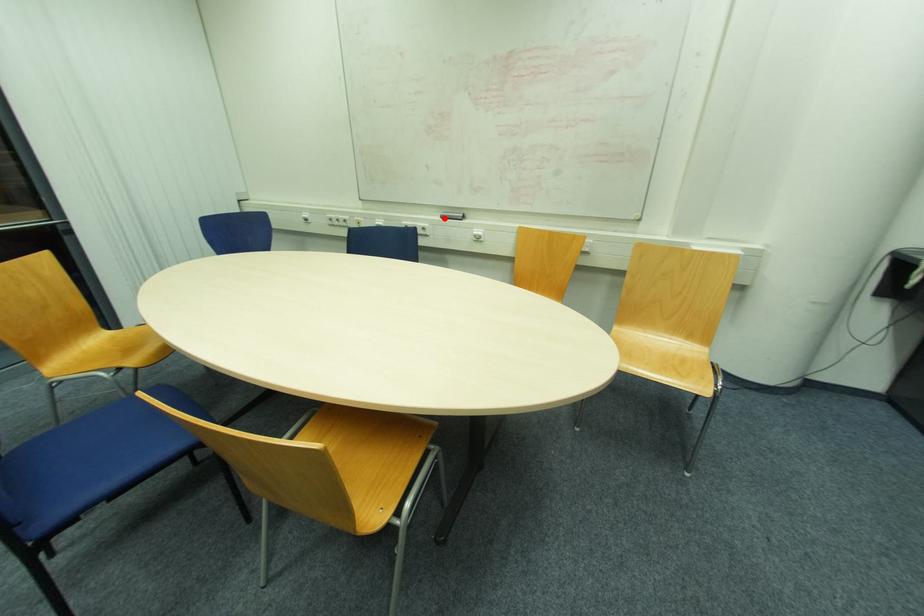
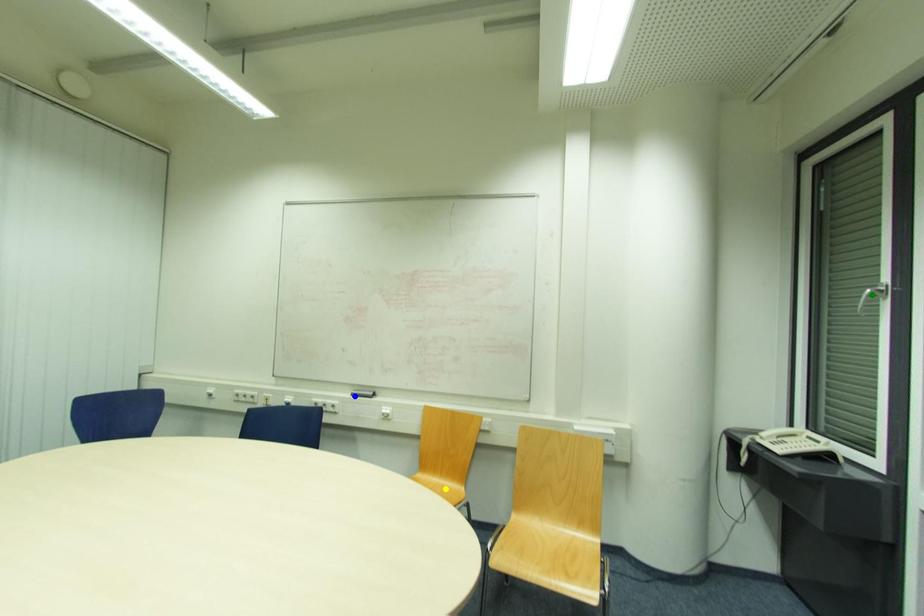
Question: I am providing you with two images of the same scene from different viewpoints. A red point is marked on the first image. You are given multiple points on the second image. Can you choose the point in image 2 that corresponds to the point in image 1?

Choices:
 (A) yellow point
 (B) blue point
 (C) green point

Answer: (B)